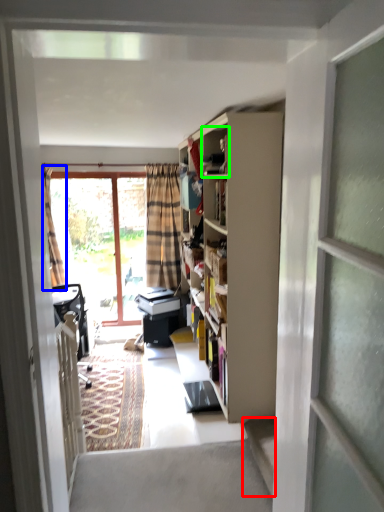
Question: Which is farther away from stairwell (highlighted by a red box)? curtain (highlighted by a blue box) or cabinet (highlighted by a green box)?

Choices:
 (A) curtain
 (B) cabinet

Answer: (A)